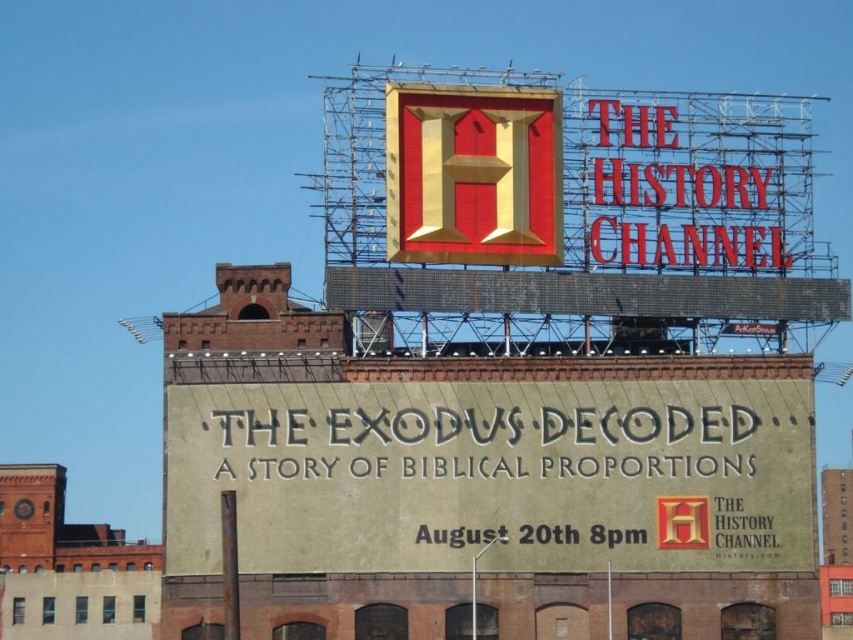
Question: Is beige textured billboard at center below gold/red textured sign at center?

Choices:
 (A) no
 (B) yes

Answer: (B)

Question: Is beige textured billboard at center further to camera compared to gold/red textured sign at center?

Choices:
 (A) yes
 (B) no

Answer: (B)

Question: Among these points, which one is farthest from the camera?

Choices:
 (A) (543, 465)
 (B) (434, 124)

Answer: (B)

Question: Which object appears closest to the camera in this image?

Choices:
 (A) beige textured billboard at center
 (B) gold/red textured sign at center

Answer: (A)

Question: Is beige textured billboard at center thinner than gold/red textured sign at center?

Choices:
 (A) no
 (B) yes

Answer: (A)